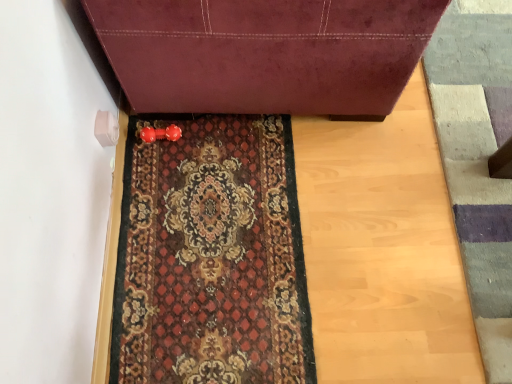
Question: From the image's perspective, would you say textured wool doormat at lower right is positioned over carpeted mat at center?

Choices:
 (A) no
 (B) yes

Answer: (B)

Question: Is textured wool doormat at lower right bigger than carpeted mat at center?

Choices:
 (A) no
 (B) yes

Answer: (B)

Question: Is carpeted mat at center located within textured wool doormat at lower right?

Choices:
 (A) yes
 (B) no

Answer: (B)

Question: Does textured wool doormat at lower right lie behind carpeted mat at center?

Choices:
 (A) yes
 (B) no

Answer: (B)

Question: Considering the relative sizes of textured wool doormat at lower right and carpeted mat at center in the image provided, is textured wool doormat at lower right wider than carpeted mat at center?

Choices:
 (A) yes
 (B) no

Answer: (B)

Question: In terms of height, does carpeted mat at center look taller or shorter compared to textured wool doormat at lower right?

Choices:
 (A) tall
 (B) short

Answer: (B)

Question: Would you say carpeted mat at center is to the left or to the right of textured wool doormat at lower right in the picture?

Choices:
 (A) right
 (B) left

Answer: (B)

Question: Looking at the image, does carpeted mat at center seem bigger or smaller compared to textured wool doormat at lower right?

Choices:
 (A) small
 (B) big

Answer: (A)

Question: Relative to textured wool doormat at lower right, is carpeted mat at center in front or behind?

Choices:
 (A) front
 (B) behind

Answer: (B)

Question: In terms of height, does textured wool doormat at lower right look taller or shorter compared to carpeted mat at center?

Choices:
 (A) tall
 (B) short

Answer: (A)

Question: Does point (474, 140) appear closer or farther from the camera than point (220, 201)?

Choices:
 (A) closer
 (B) farther

Answer: (B)

Question: Visually, is textured wool doormat at lower right positioned to the left or to the right of carpeted mat at center?

Choices:
 (A) right
 (B) left

Answer: (A)

Question: From a real-world perspective, is textured wool doormat at lower right above or below carpeted mat at center?

Choices:
 (A) above
 (B) below

Answer: (A)

Question: From their relative heights in the image, would you say velvet burgundy sofa at center is taller or shorter than carpeted mat at center?

Choices:
 (A) short
 (B) tall

Answer: (B)

Question: Looking at their shapes, would you say velvet burgundy sofa at center is wider or thinner than carpeted mat at center?

Choices:
 (A) wide
 (B) thin

Answer: (A)